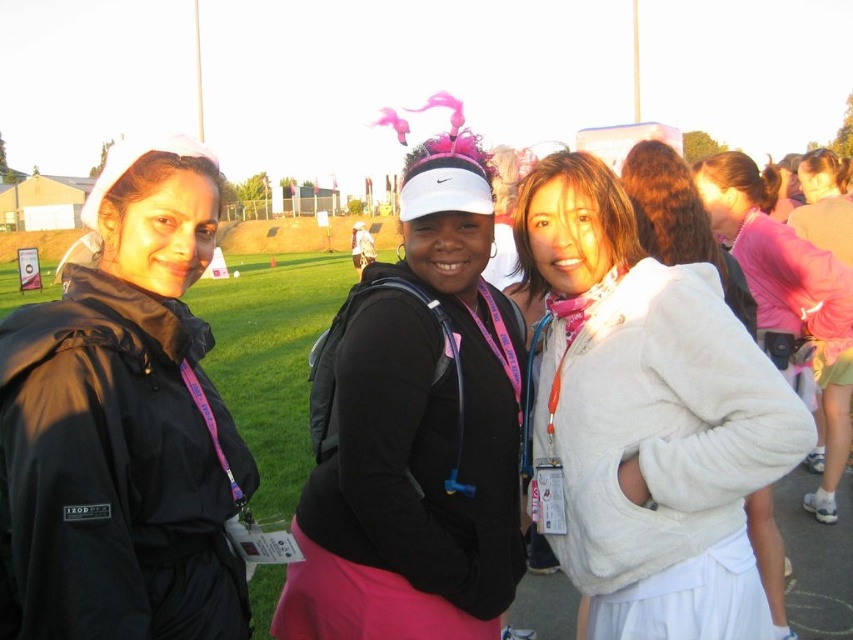
Can you confirm if black matte jacket at left is smaller than white fuzzy jacket at center?

Indeed, black matte jacket at left has a smaller size compared to white fuzzy jacket at center.

Between black matte jacket at left and white fuzzy jacket at center, which one has less height?

black matte jacket at left

The width and height of the screenshot is (853, 640). In order to click on black matte jacket at left in this screenshot , I will do `click(122, 424)`.

Looking at this image, does pink matte visor at center appear on the left side of white fuzzy jacket at center?

Correct, you'll find pink matte visor at center to the left of white fuzzy jacket at center.

Does pink matte visor at center come in front of white fuzzy jacket at center?

That is False.

Is point (427, 515) in front of point (563, 492)?

Yes, it is.

Where is `pink matte visor at center`? pink matte visor at center is located at coordinates (418, 429).

Is black matte jacket at left to the left of pink matte visor at center from the viewer's perspective?

Correct, you'll find black matte jacket at left to the left of pink matte visor at center.

Which is below, black matte jacket at left or pink matte visor at center?

Positioned lower is black matte jacket at left.

Locate an element on the screen. black matte jacket at left is located at coordinates (122, 424).